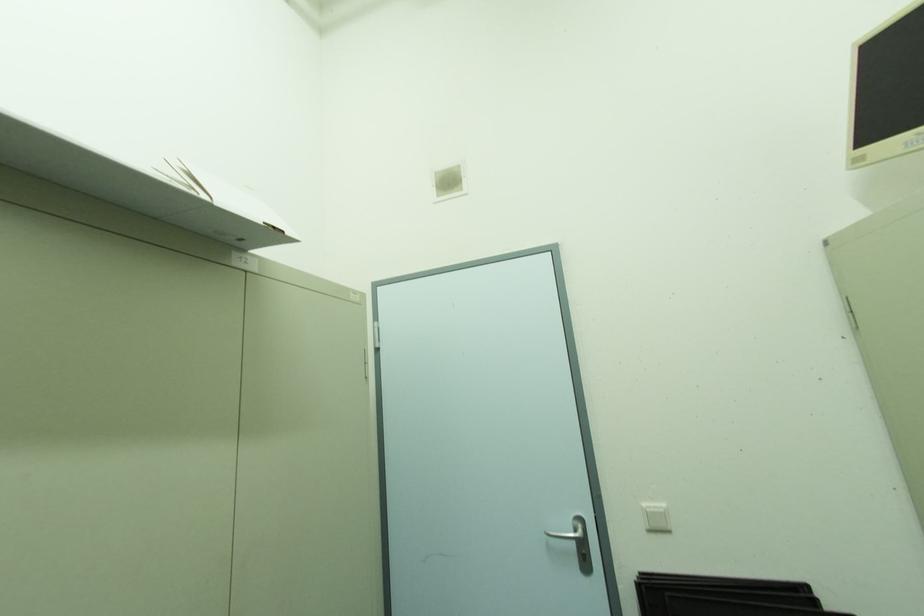
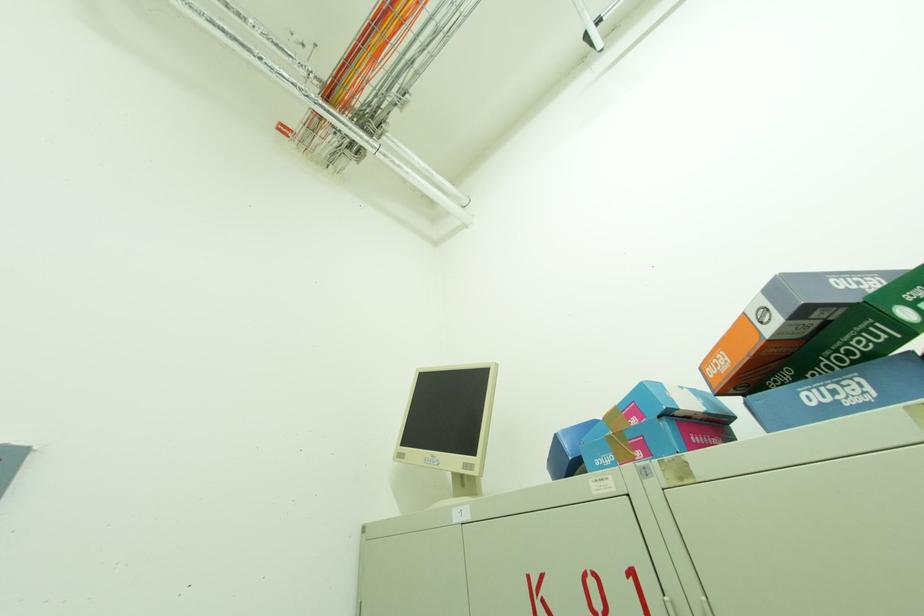
First-person continuous shooting, in which direction is the camera rotating?

The camera's rotation is toward right-up.